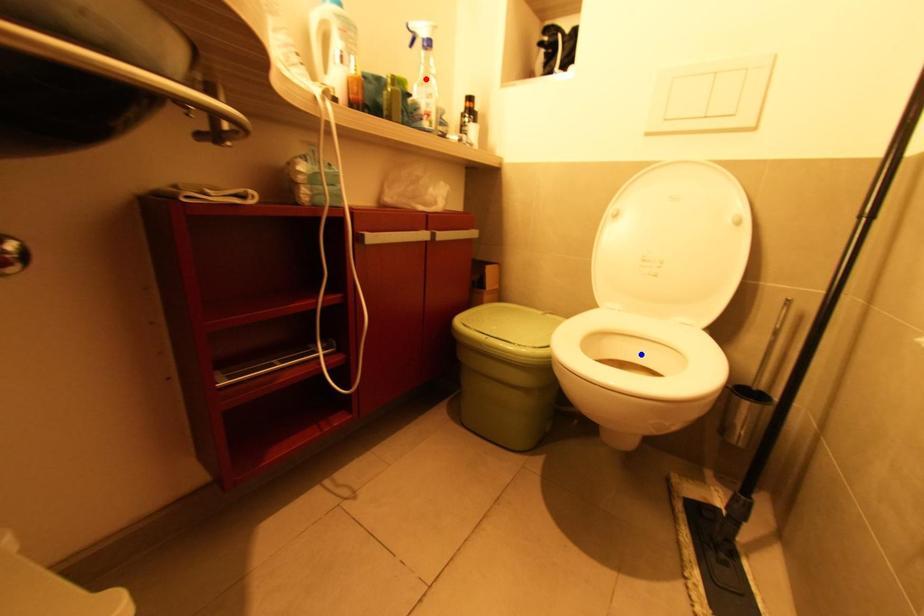
Question: Which of the two points in the image is closer to the camera?

Choices:
 (A) Blue point is closer.
 (B) Red point is closer.

Answer: (A)